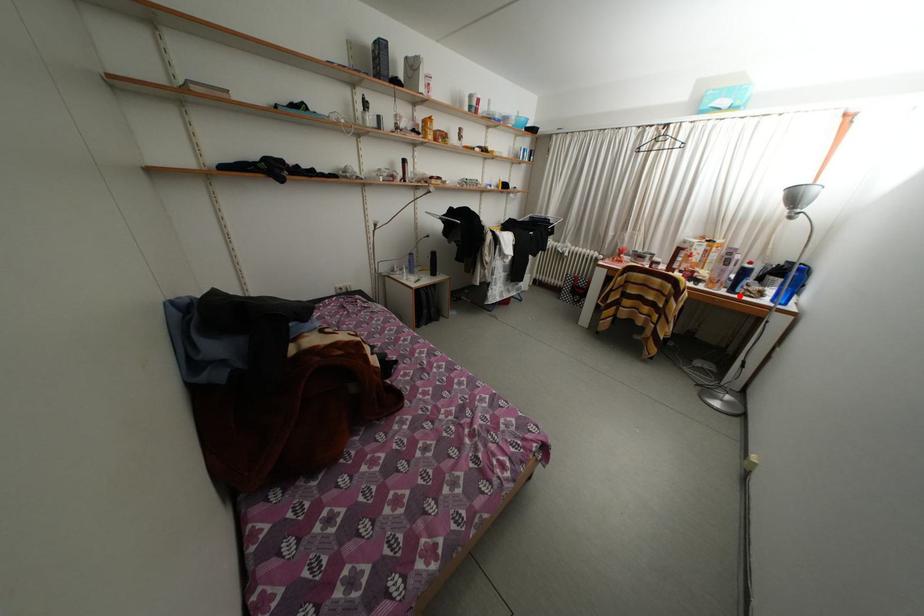
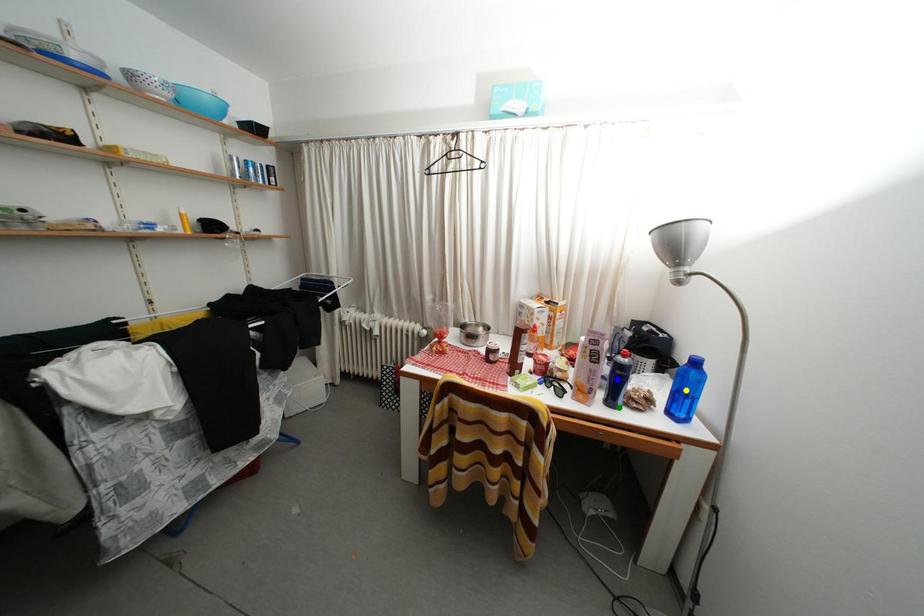
Question: I am providing you with two images of the same scene from different viewpoints. A red point is marked on the first image. You are given multiple points on the second image. Which point in image 2 represents the same 3d spot as the red point in image 1?

Choices:
 (A) blue point
 (B) yellow point
 (C) green point

Answer: (C)